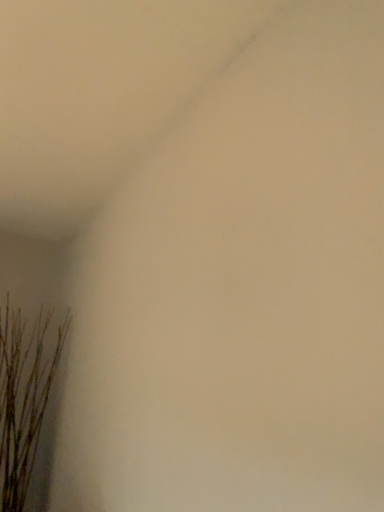
The image size is (384, 512). What are the coordinates of `brown textured plant at lower left` in the screenshot? It's located at (25, 394).

What do you see at coordinates (25, 394) in the screenshot? I see `brown textured plant at lower left` at bounding box center [25, 394].

Identify the location of brown textured plant at lower left. (25, 394).